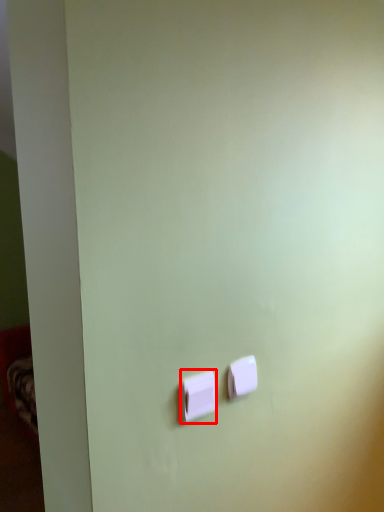
Question: From the image, what is the correct spatial relationship of light switch (annotated by the red box) in relation to light switch?

Choices:
 (A) right
 (B) left

Answer: (B)